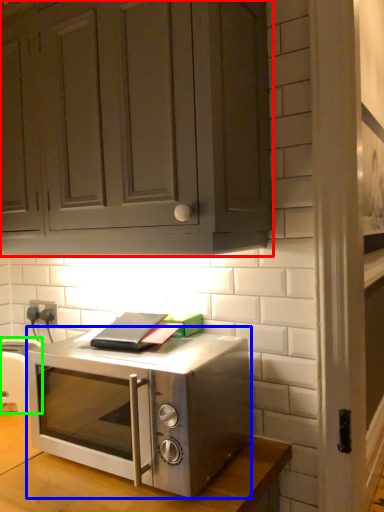
Question: Which is nearer to the cabinetry (highlighted by a red box)? microwave oven (highlighted by a blue box) or appliance (highlighted by a green box).

Choices:
 (A) microwave oven
 (B) appliance

Answer: (A)